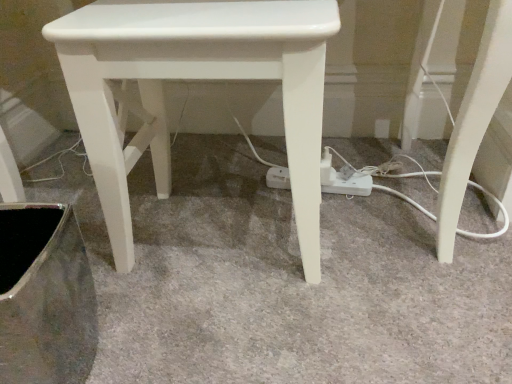
Question: Looking at their shapes, would you say white plastic extension cord at center is wider or thinner than metallic silver swivel chair at lower left?

Choices:
 (A) wide
 (B) thin

Answer: (B)

Question: Is white plastic extension cord at center to the left or to the right of metallic silver swivel chair at lower left in the image?

Choices:
 (A) left
 (B) right

Answer: (B)

Question: Which object is positioned closest to the white plastic extension cord at center?

Choices:
 (A) metallic silver swivel chair at lower left
 (B) white glossy stool at center

Answer: (B)

Question: Which object is positioned closest to the white plastic extension cord at center?

Choices:
 (A) metallic silver swivel chair at lower left
 (B) white glossy stool at center

Answer: (B)